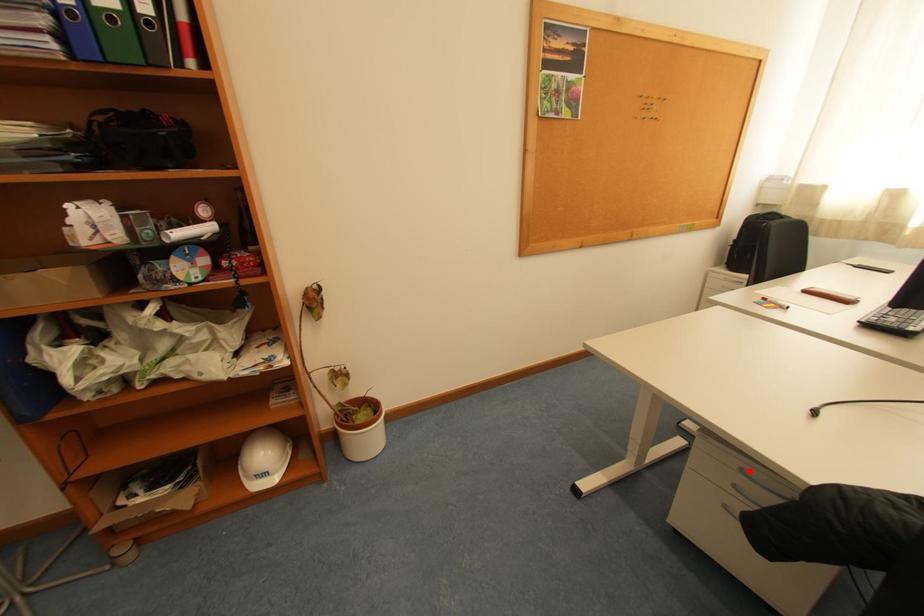
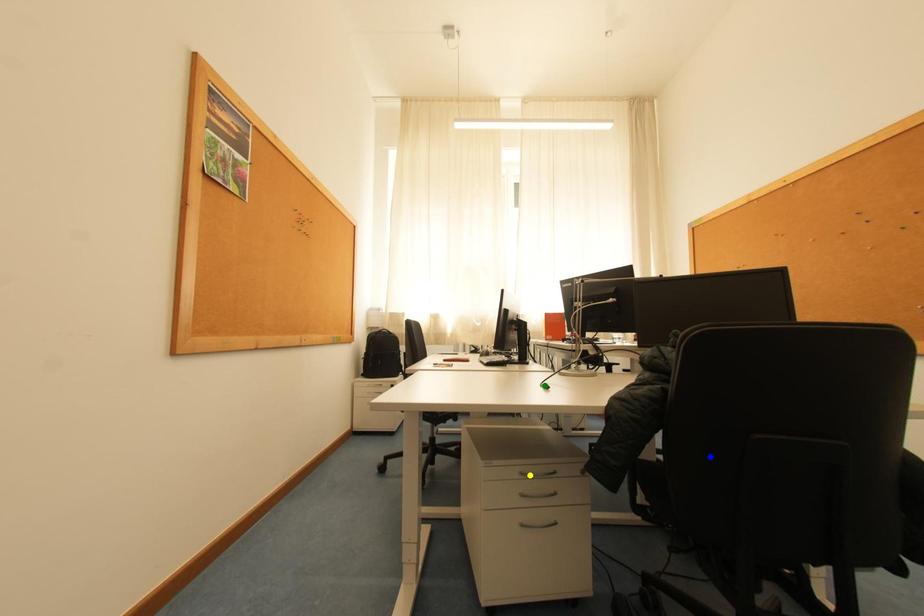
Question: I am providing you with two images of the same scene from different viewpoints. A red point is marked on the first image. You are given multiple points on the second image. Which spot in image 2 lines up with the point in image 1?

Choices:
 (A) green point
 (B) yellow point
 (C) blue point

Answer: (B)